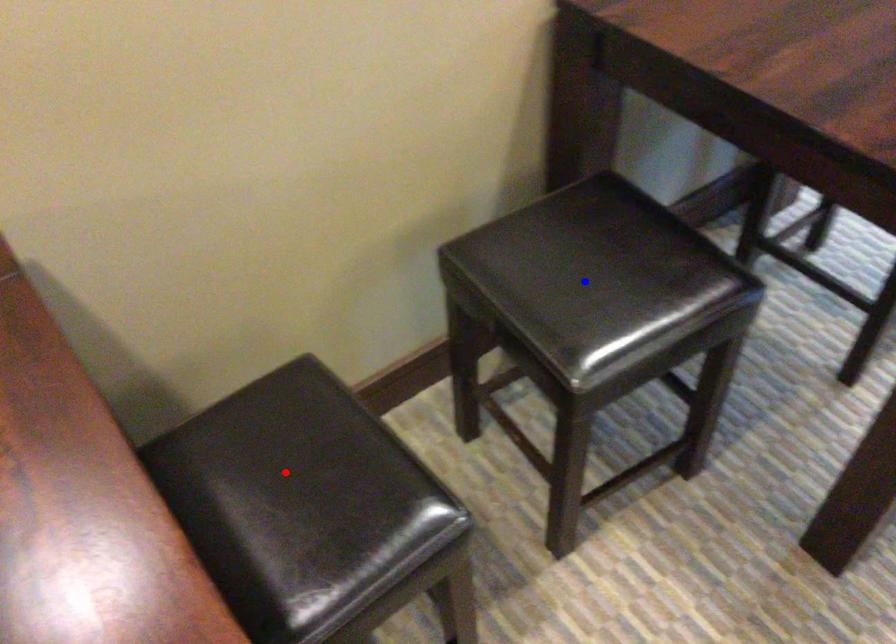
Question: Two points are marked on the image. Which point is closer to the camera?

Choices:
 (A) Blue point is closer.
 (B) Red point is closer.

Answer: (B)